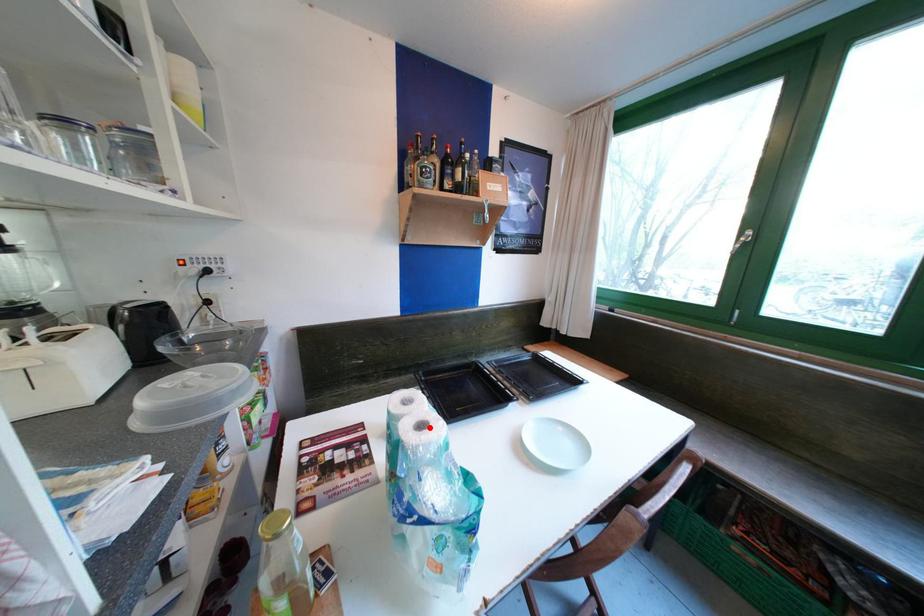
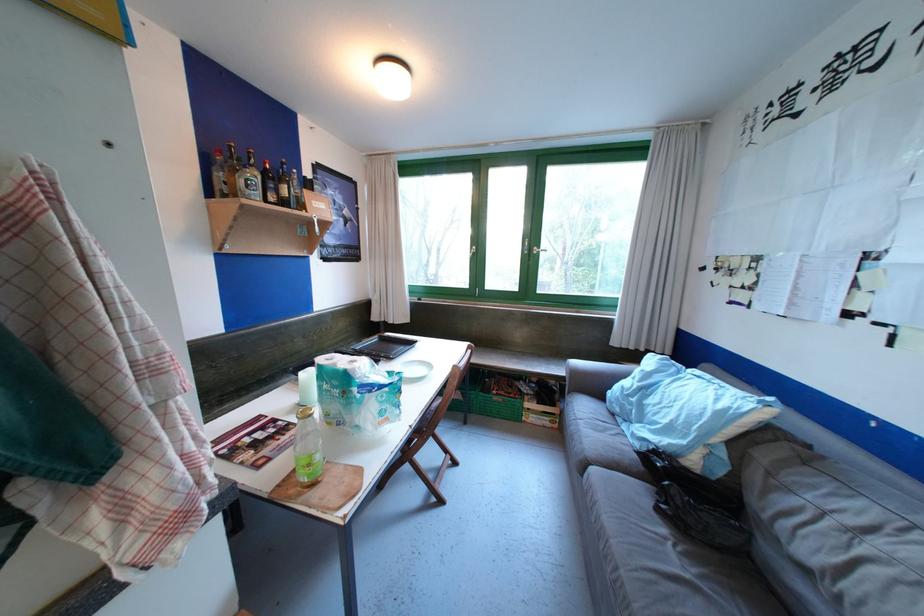
Locate, in the second image, the point that corresponds to the highlighted location in the first image.

(359, 363)